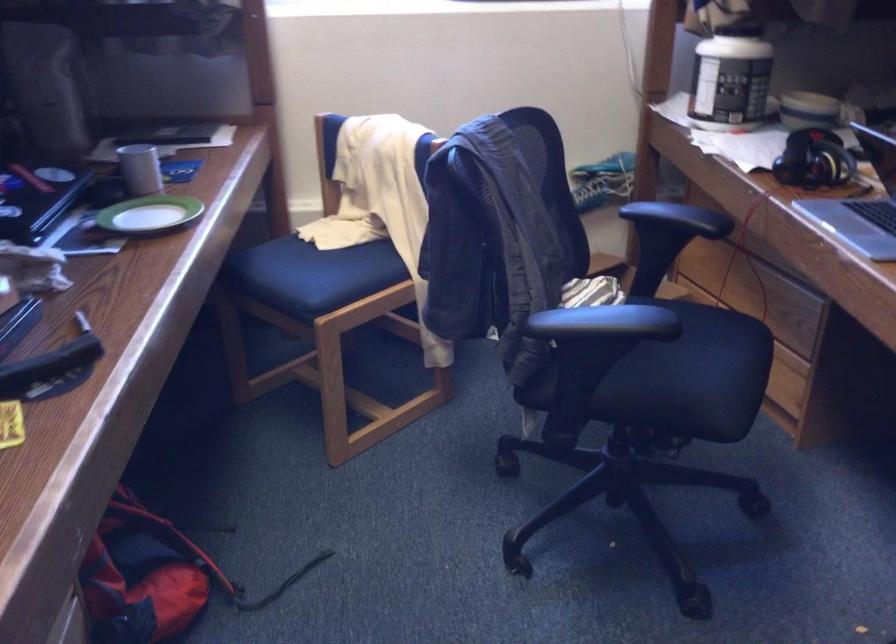
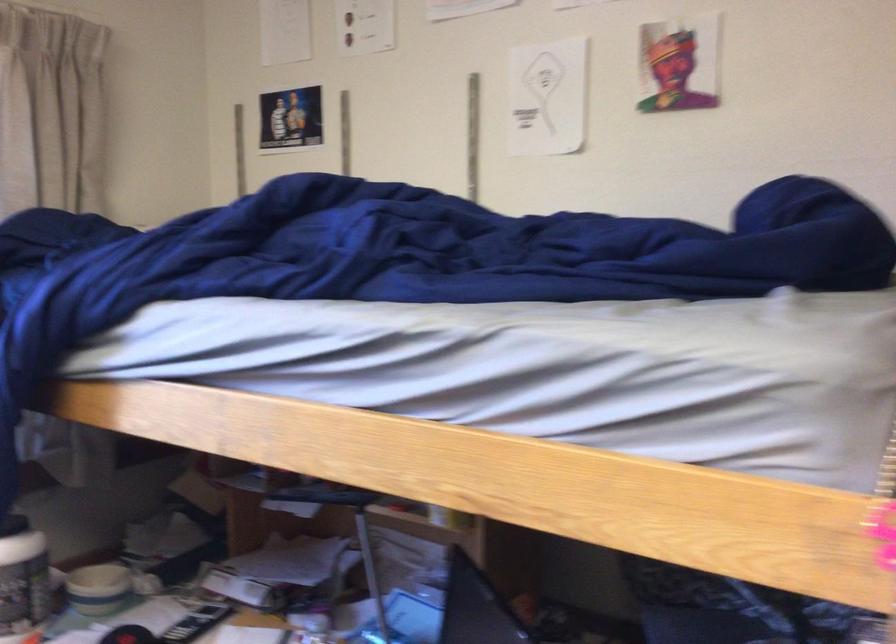
Where in the second image is the point corresponding to pixel 803 98 from the first image?

(98, 589)